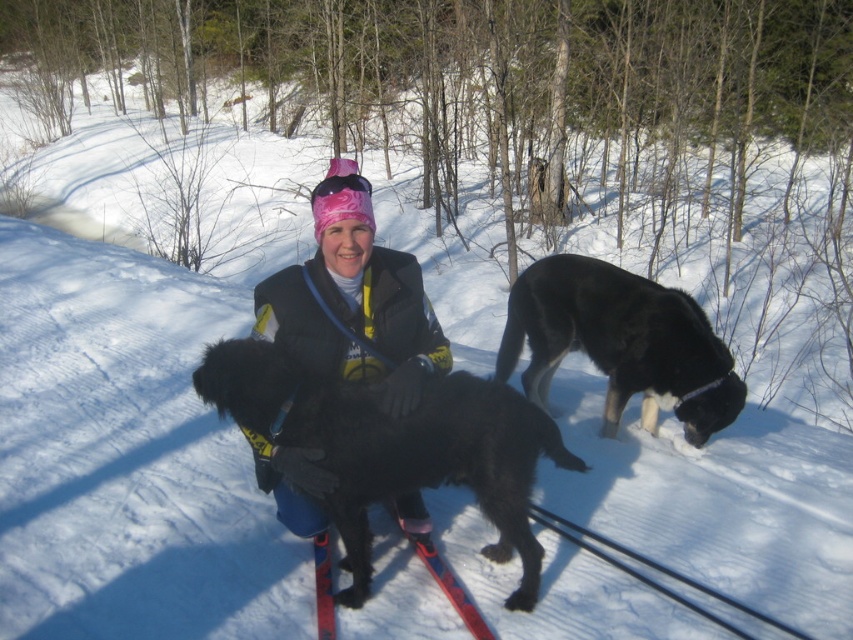
Question: Does black fur dog at right have a greater width compared to red plastic ski at center?

Choices:
 (A) yes
 (B) no

Answer: (A)

Question: Which point is farther to the camera?

Choices:
 (A) (345, 492)
 (B) (320, 589)
 (C) (531, 296)
 (D) (383, 400)

Answer: (C)

Question: Is black fuzzy dog at center further to the viewer compared to black fur dog at right?

Choices:
 (A) yes
 (B) no

Answer: (B)

Question: Estimate the real-world distances between objects in this image. Which object is closer to the matte black jacket at center?

Choices:
 (A) black fuzzy dog at center
 (B) red plastic ski at center
 (C) black fur dog at right

Answer: (A)

Question: Is the position of black fuzzy dog at center less distant than that of black fur dog at right?

Choices:
 (A) no
 (B) yes

Answer: (B)

Question: Which point is closer to the camera taking this photo?

Choices:
 (A) (271, 323)
 (B) (473, 634)
 (C) (607, 262)

Answer: (A)